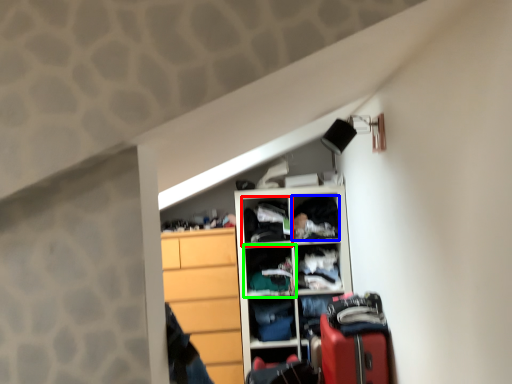
Question: Based on their relative distances, which object is farther from cabinet (highlighted by a red box)? Choose from clothing (highlighted by a blue box) and shelf (highlighted by a green box).

Choices:
 (A) clothing
 (B) shelf

Answer: (A)